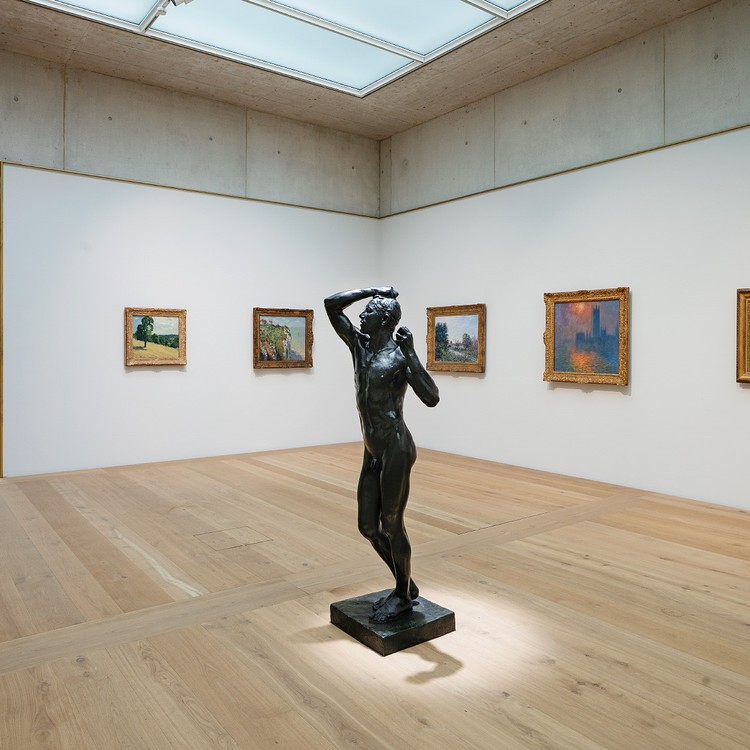
Locate an element on the screen. This screenshot has height=750, width=750. ceiling is located at coordinates (278, 100), (577, 27).